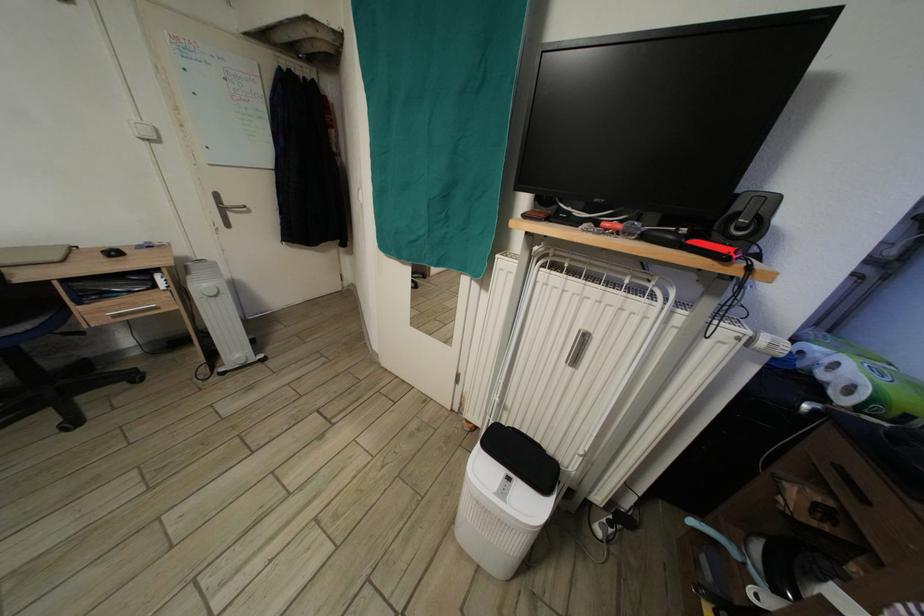
This screenshot has height=616, width=924. I want to click on black trash can lid, so click(505, 499).